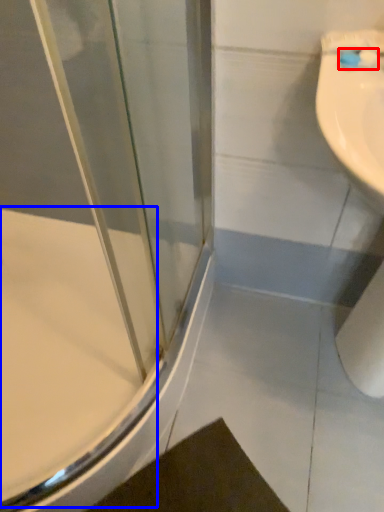
Question: Which object appears closest to the camera in this image, toothbrush (highlighted by a red box) or bath (highlighted by a blue box)?

Choices:
 (A) toothbrush
 (B) bath

Answer: (A)